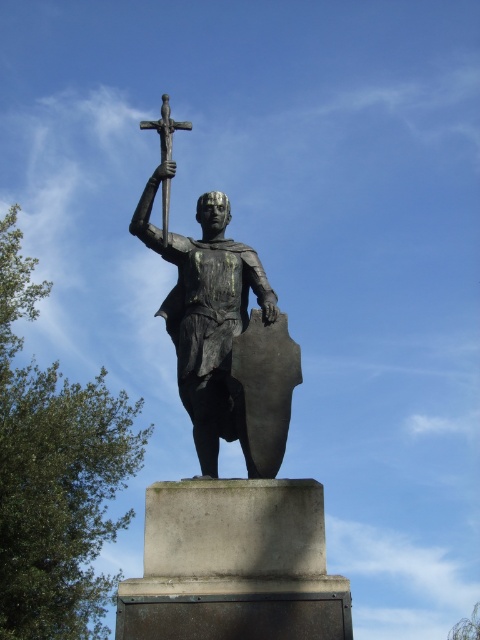
In the scene shown: You are a tour guide explaining the monuments in the park. You need to mention both the bronze statue at center and the polished bronze cross at upper center. Which one is taller?

The bronze statue at center is shorter than the polished bronze cross at upper center, so the polished bronze cross at upper center is taller.

You are an art conservator examining the bronze statue at center and the polished bronze cross at upper center. Which object is nearer to you in the scene?

The bronze statue at center is closer to the viewer than the polished bronze cross at upper center.